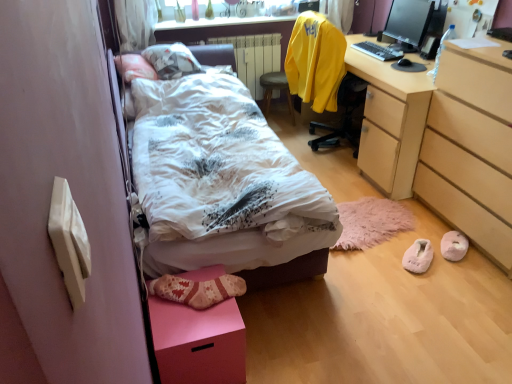
Question: From the image's perspective, is matte black monitor at upper right above or below white fluffy slippers at lower right, the 1th footwear viewed from the left?

Choices:
 (A) above
 (B) below

Answer: (A)

Question: In the image, is matte black monitor at upper right positioned in front of or behind white fluffy slippers at lower right, the 1th footwear viewed from the left?

Choices:
 (A) behind
 (B) front

Answer: (A)

Question: Considering the real-world distances, which object is closest to the matte black monitor at upper right?

Choices:
 (A) light brown wood chest of drawers at lower right
 (B) white soft bed at center
 (C) pink matte shoe box at lower left
 (D) peachy suede slippers at lower right, which is the first footwear in right-to-left order
 (E) wooden stool at center

Answer: (E)

Question: Estimate the real-world distances between objects in this image. Which object is closer to the yellow fabric chair at upper right?

Choices:
 (A) white painted metal radiator at center
 (B) light brown wood chest of drawers at lower right
 (C) pink matte shoe box at lower left
 (D) white fluffy slippers at lower right, which is counted as the 2th footwear, starting from the right
 (E) peachy suede slippers at lower right, which is the 2th footwear in left-to-right order

Answer: (A)